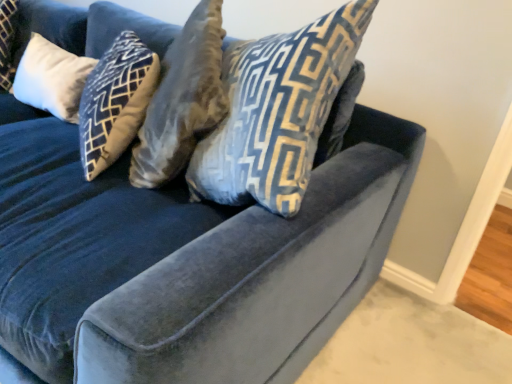
Question: From the image's perspective, does white soft cushion at upper left, positioned as the first pillow in back-to-front order, appear higher than velvet blue pillow at center, the 1th pillow when ordered from right to left?

Choices:
 (A) yes
 (B) no

Answer: (A)

Question: Would you say white soft cushion at upper left, the second pillow in the right-to-left sequence, is outside velvet blue pillow at center, which ranks as the 2th pillow in back-to-front order?

Choices:
 (A) no
 (B) yes

Answer: (B)

Question: Considering the relative sizes of white soft cushion at upper left, which is the 1th pillow from left to right, and velvet blue pillow at center, arranged as the 2th pillow when viewed from the left, in the image provided, is white soft cushion at upper left, which is the 1th pillow from left to right, taller than velvet blue pillow at center, arranged as the 2th pillow when viewed from the left,?

Choices:
 (A) yes
 (B) no

Answer: (B)

Question: Can velvet blue pillow at center, which ranks as the 2th pillow in back-to-front order, be found inside white soft cushion at upper left, which is the 1th pillow from left to right?

Choices:
 (A) no
 (B) yes

Answer: (A)

Question: Can you confirm if white soft cushion at upper left, which is the 1th pillow from left to right, is smaller than velvet blue pillow at center, the 1th pillow when ordered from right to left?

Choices:
 (A) no
 (B) yes

Answer: (B)

Question: From a real-world perspective, is white soft cushion at upper left, which appears as the 2th pillow when viewed from the front, positioned under velvet blue pillow at center, which is counted as the 1th pillow, starting from the front, based on gravity?

Choices:
 (A) yes
 (B) no

Answer: (A)

Question: From the image's perspective, is velvet blue pillow at center, which is counted as the 1th pillow, starting from the front, beneath white soft cushion at upper left, which is the 1th pillow from left to right?

Choices:
 (A) no
 (B) yes

Answer: (B)

Question: Are velvet blue pillow at center, the 1th pillow when ordered from right to left, and white soft cushion at upper left, the second pillow in the right-to-left sequence, located far from each other?

Choices:
 (A) no
 (B) yes

Answer: (A)

Question: Is velvet blue pillow at center, arranged as the 2th pillow when viewed from the left, wider than white soft cushion at upper left, positioned as the first pillow in back-to-front order?

Choices:
 (A) yes
 (B) no

Answer: (A)

Question: Considering the relative sizes of velvet blue pillow at center, which is counted as the 1th pillow, starting from the front, and white soft cushion at upper left, the second pillow in the right-to-left sequence, in the image provided, is velvet blue pillow at center, which is counted as the 1th pillow, starting from the front, taller than white soft cushion at upper left, the second pillow in the right-to-left sequence,?

Choices:
 (A) yes
 (B) no

Answer: (A)

Question: From a real-world perspective, is velvet blue pillow at center, which is counted as the 1th pillow, starting from the front, under white soft cushion at upper left, which appears as the 2th pillow when viewed from the front?

Choices:
 (A) yes
 (B) no

Answer: (B)

Question: Considering the relative positions of velvet blue pillow at center, which ranks as the 2th pillow in back-to-front order, and white soft cushion at upper left, which appears as the 2th pillow when viewed from the front, in the image provided, is velvet blue pillow at center, which ranks as the 2th pillow in back-to-front order, to the right of white soft cushion at upper left, which appears as the 2th pillow when viewed from the front, from the viewer's perspective?

Choices:
 (A) no
 (B) yes

Answer: (B)

Question: Considering the positions of point (274, 119) and point (59, 87), is point (274, 119) closer or farther from the camera than point (59, 87)?

Choices:
 (A) closer
 (B) farther

Answer: (A)